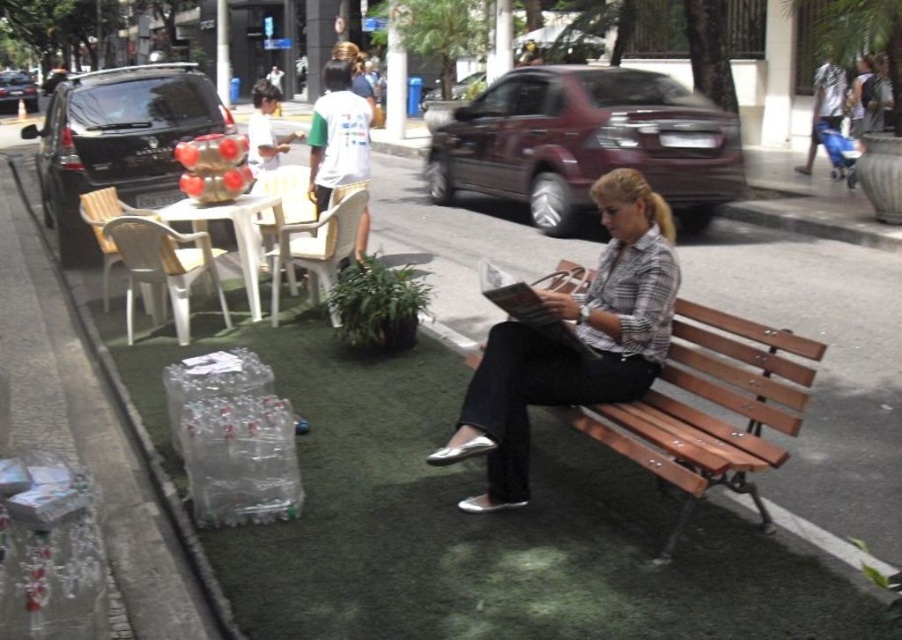
Does plaid fabric shirt at center come behind wooden bench at center?

Yes, it is behind wooden bench at center.

This screenshot has width=902, height=640. In order to click on plaid fabric shirt at center in this screenshot , I will do `click(578, 339)`.

Where is `plaid fabric shirt at center`? This screenshot has width=902, height=640. plaid fabric shirt at center is located at coordinates (578, 339).